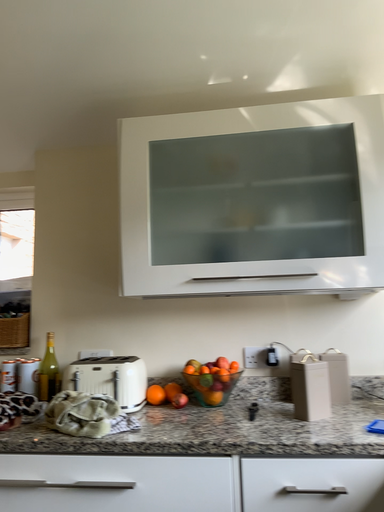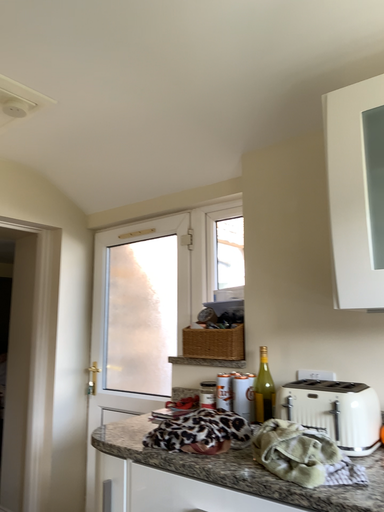
Question: Which way did the camera rotate in the video?

Choices:
 (A) rotated left
 (B) rotated right

Answer: (A)